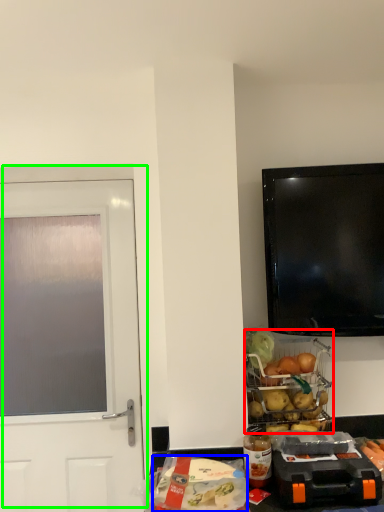
Question: Which object is the closest to the appliance (highlighted by a red box)? Choose among these: food (highlighted by a blue box) or door (highlighted by a green box).

Choices:
 (A) food
 (B) door

Answer: (A)